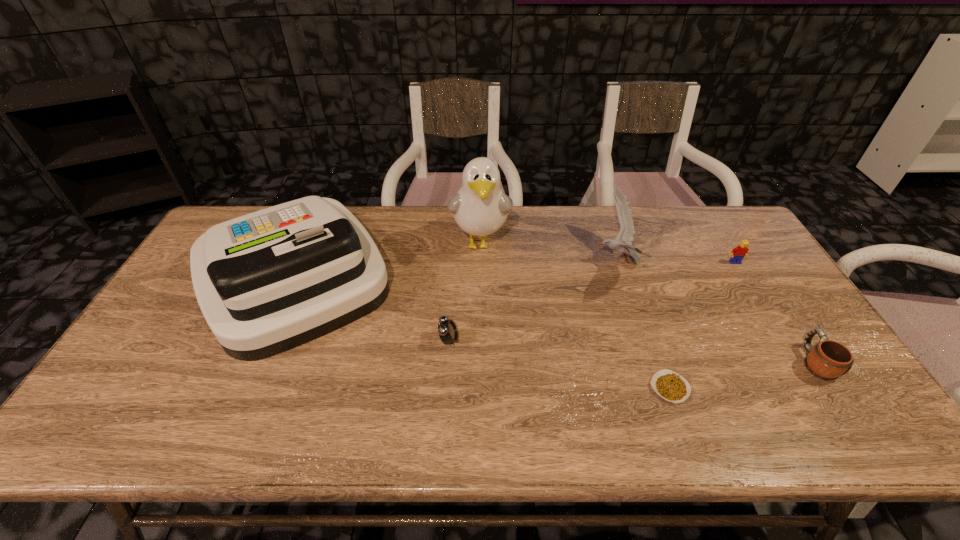
Where is `vacant space situated on the beak of the taller gull`? The image size is (960, 540). vacant space situated on the beak of the taller gull is located at coordinates (480, 282).

Find the location of a particular element. blank space located on the right of the second tallest object is located at coordinates click(x=428, y=278).

The height and width of the screenshot is (540, 960). I want to click on free location located 0.170m at the tip of the beak of the shorter gull, so click(540, 261).

Find the location of a particular element. vacant space located at the tip of the beak of the shorter gull is located at coordinates (550, 261).

The height and width of the screenshot is (540, 960). Identify the location of free spot located 0.390m at the tip of the beak of the shorter gull. (470, 261).

Locate an element on the screen. This screenshot has width=960, height=540. vacant space located 0.060m on the face of the Lego is located at coordinates (745, 278).

Identify the location of vacant space located 0.050m on the face of the alarm clock. (477, 340).

Locate an element on the screen. This screenshot has height=540, width=960. vacant space located 0.110m on the side of the mug with the handle is located at coordinates (781, 311).

You are a GUI agent. You are given a task and a screenshot of the screen. Output one action in this format:
    pyautogui.click(x=<x>, y=<y>)
    Task: Click on the free space located on the side of the mug with the handle
    This screenshot has width=960, height=540.
    Given the screenshot: What is the action you would take?
    pyautogui.click(x=791, y=325)

At what (x,y) coordinates should I click in order to perform the action: click on vacant space located on the side of the mug with the handle. Please return your answer as a coordinate pair (x, y). The image size is (960, 540). Looking at the image, I should click on (759, 276).